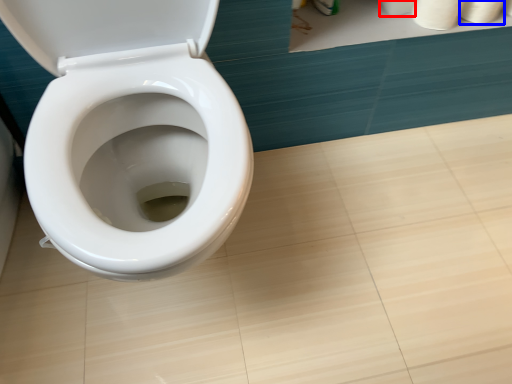
Question: Among these objects, which one is nearest to the camera, toilet paper (highlighted by a red box) or toilet paper (highlighted by a blue box)?

Choices:
 (A) toilet paper
 (B) toilet paper

Answer: (B)